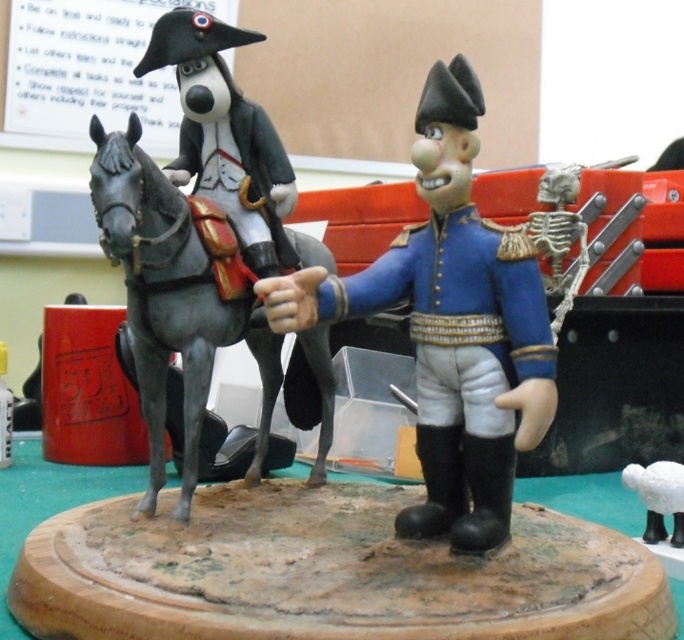
In the miniature diorama scene, you need to determine which animal is taller between the shiny gray horse at left and the white matte sheep at lower right. Based on the scene, which one is taller?

The shiny gray horse at left is taller than the white matte sheep at lower right.

You are a collector who wants to display the blue glossy toy soldier at center on a shelf that can only accommodate items up to 26 inches in depth. Can the toy soldier be placed on this shelf without exceeding the depth limit?

The blue glossy toy soldier at center is 26.46 inches away from the viewer, which exceeds the shelf depth limit of 26 inches. Therefore, it cannot be placed on the shelf without exceeding the depth limit.